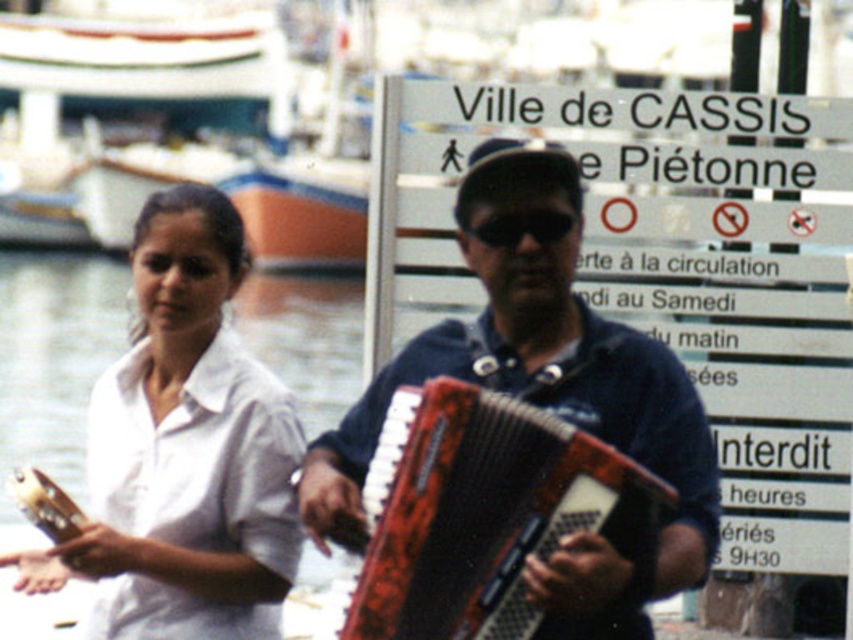
Question: Which of the following is the farthest from the observer?

Choices:
 (A) white matte shirt at upper left
 (B) black matte sunglasses at center

Answer: (A)

Question: Which of the following is the farthest from the observer?

Choices:
 (A) (546, 243)
 (B) (553, 394)
 (C) (451, 438)
 (D) (241, 259)

Answer: (D)

Question: Is white matte shirt at upper left closer to camera compared to black matte sunglasses at center?

Choices:
 (A) no
 (B) yes

Answer: (A)

Question: Is white matte shirt at upper left positioned before rusty metal accordion at center?

Choices:
 (A) no
 (B) yes

Answer: (A)

Question: Based on their relative distances, which object is nearer to the black matte sunglasses at center?

Choices:
 (A) white matte shirt at upper left
 (B) rusty metal accordion at center

Answer: (B)

Question: Can you confirm if wooden accordion at center is positioned to the right of black matte sunglasses at center?

Choices:
 (A) no
 (B) yes

Answer: (A)